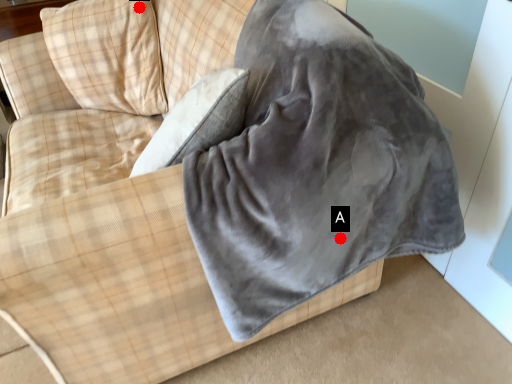
Question: Two points are circled on the image, labeled by A and B beside each circle. Which point is closer to the camera taking this photo?

Choices:
 (A) A is closer
 (B) B is closer

Answer: (A)